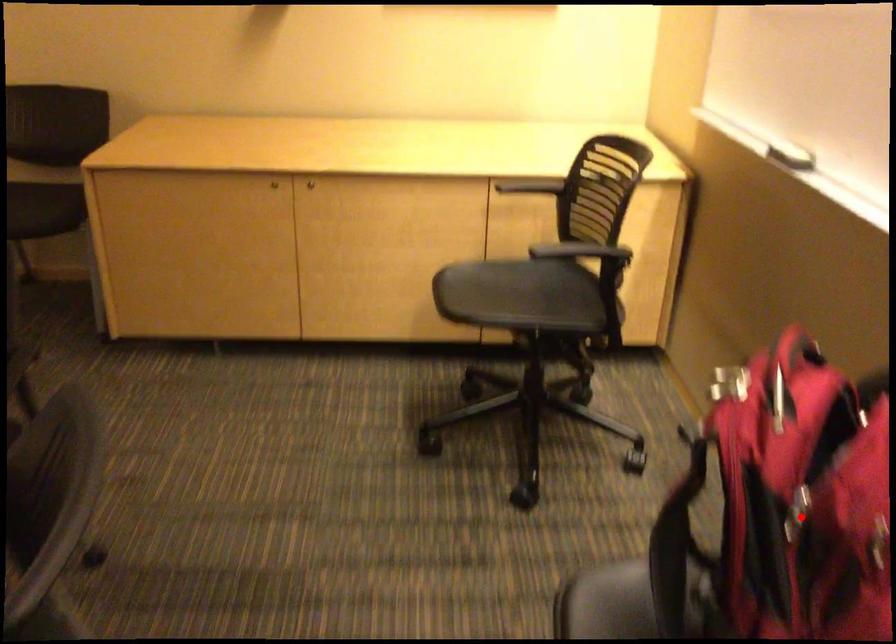
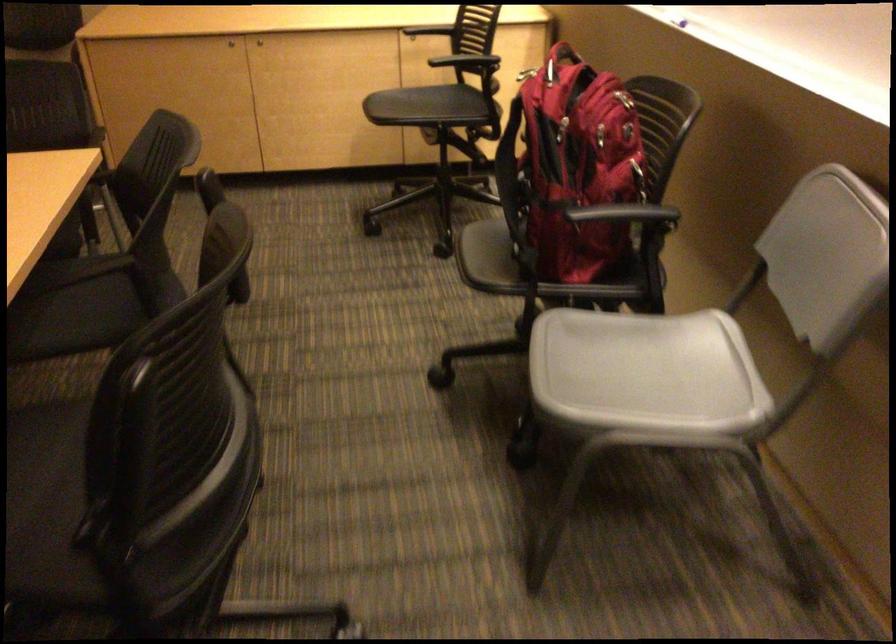
Question: I am providing you with two images of the same scene from different viewpoints. A red point is marked on the first image. At the location where the point appears in image 1, is it still visible in image 2?

Choices:
 (A) Yes
 (B) No

Answer: (A)